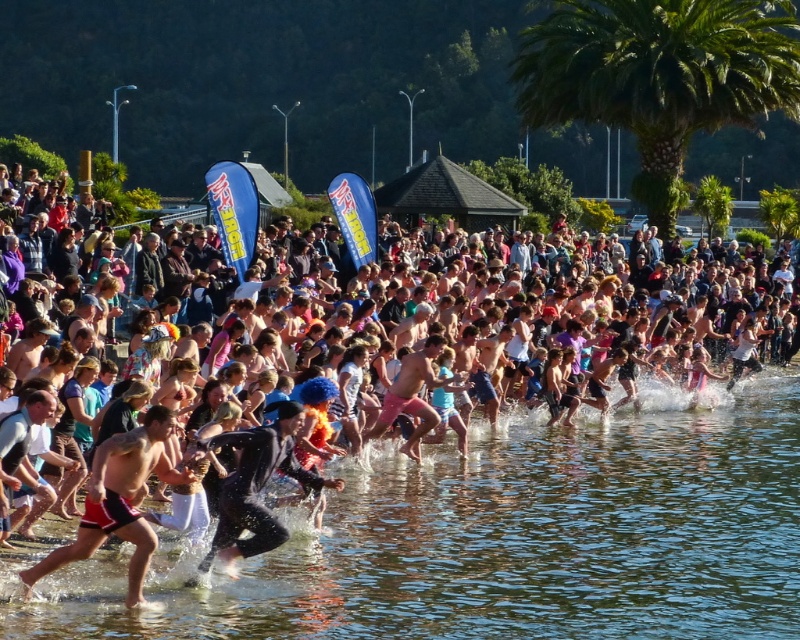
You are a photographer standing at the edge of the water, wanting to capture both the clear water at center and the pink fabric crowd at center in a single shot. Which object should you focus on first to ensure both are in the frame?

You should focus on the clear water at center first since it is closer to the viewer than the pink fabric crowd at center, allowing you to frame both effectively.

You are a photographer trying to capture the crowd and the water in the scene. Since you want both the pink fabric crowd at center and the clear water at center to be visible in your photo, which one should you focus on first to ensure depth of field?

The clear water at center is shorter than the pink fabric crowd at center. To ensure both are in focus, you should focus on the pink fabric crowd at center because it is farther away, allowing the closer clear water to still be within the depth of field range.